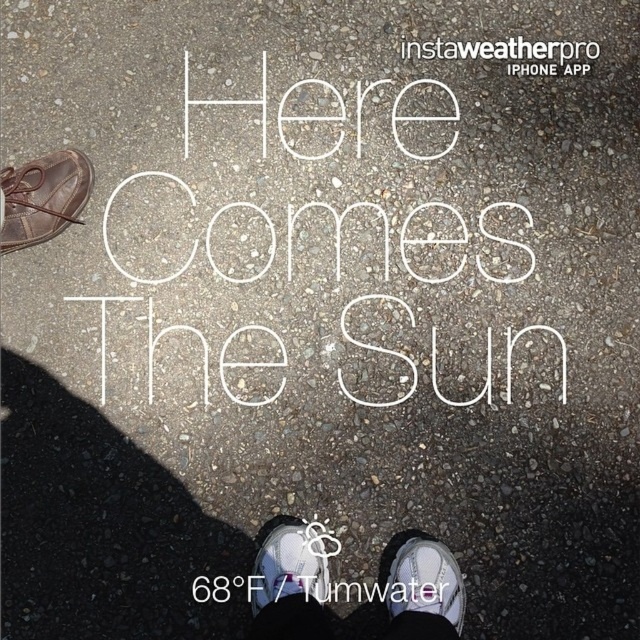
Does white canvas shoe at lower center appear under white mesh shoe at lower center?

Correct, white canvas shoe at lower center is located below white mesh shoe at lower center.

Is white canvas shoe at lower center above white mesh shoe at lower center?

No, white canvas shoe at lower center is not above white mesh shoe at lower center.

Looking at this image, who is more distant from viewer, (413, 632) or (435, 588)?

Point (435, 588)

Locate an element on the screen. white canvas shoe at lower center is located at coordinates (289, 586).

Between white canvas shoe at lower center and brown leather shoe at upper left, which one has less height?

white canvas shoe at lower center is shorter.

From the picture: Between white canvas shoe at lower center and brown leather shoe at upper left, which one appears on the left side from the viewer's perspective?

From the viewer's perspective, brown leather shoe at upper left appears more on the left side.

Which is behind, point (291, 620) or point (8, 225)?

Point (8, 225)

Locate an element on the screen. white canvas shoe at lower center is located at coordinates (289, 586).

Between white canvas shoe at lower center and white leather shoe at center, which one is positioned lower?

white canvas shoe at lower center

Which is behind, point (285, 609) or point (268, 552)?

The point (268, 552) is behind.

Is point (300, 564) more distant than point (305, 547)?

No, it is not.

The width and height of the screenshot is (640, 640). In order to click on white canvas shoe at lower center in this screenshot , I will do `click(289, 586)`.